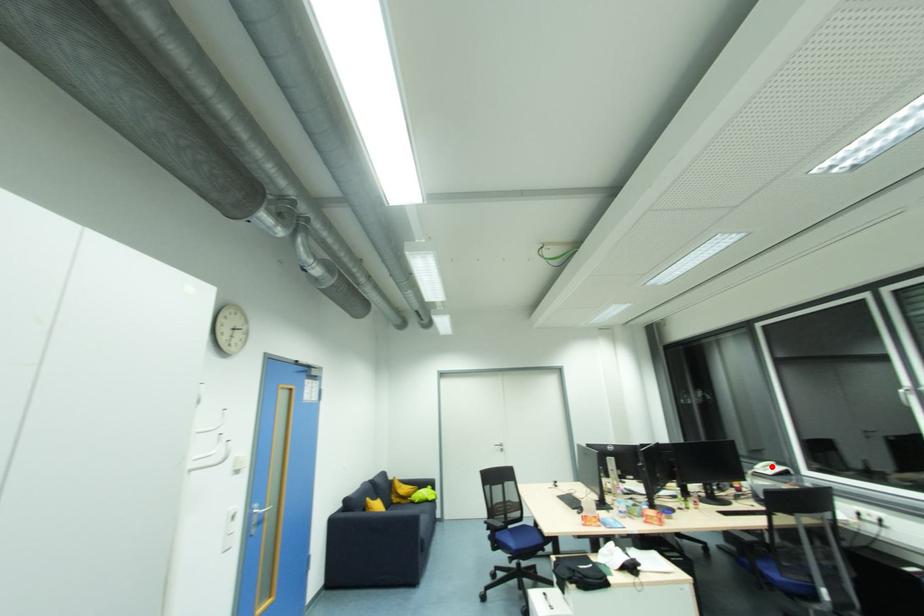
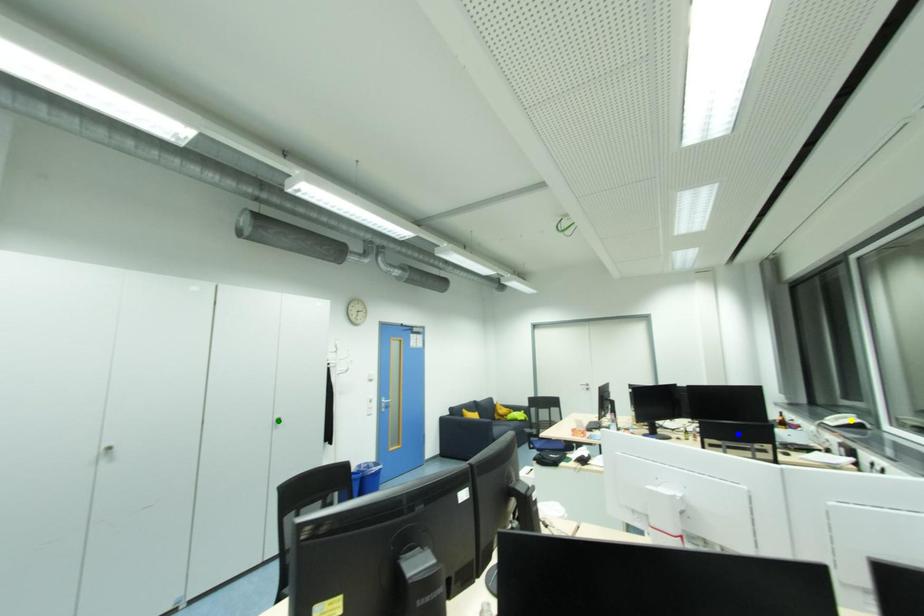
Question: I am providing you with two images of the same scene from different viewpoints. A red point is marked on the first image. You are given multiple points on the second image. Can you choose the point in image 2 that corresponds to the point in image 1?

Choices:
 (A) yellow point
 (B) blue point
 (C) green point

Answer: (A)